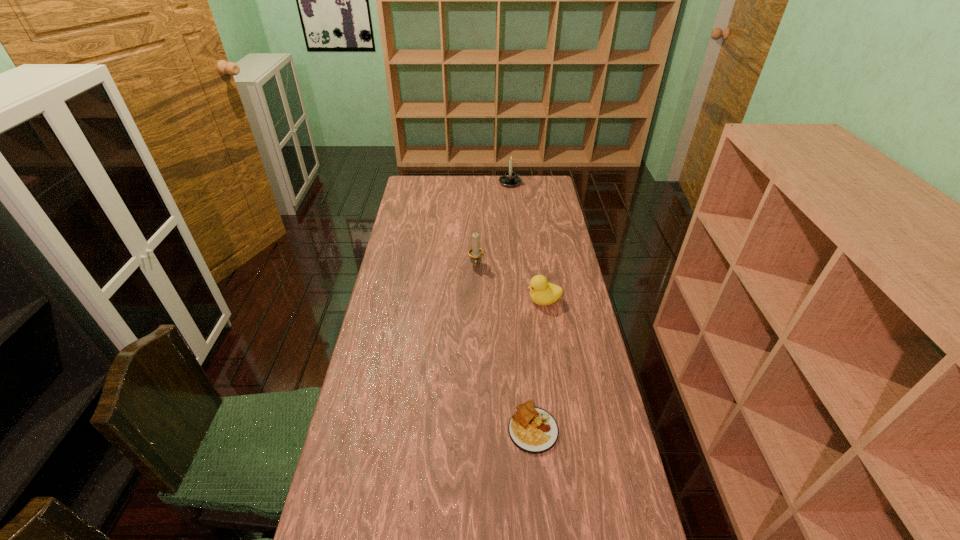
Find the location of a particular element. Image resolution: width=960 pixels, height=540 pixels. the left candle holder is located at coordinates (475, 253).

At what (x,y) coordinates should I click in order to perform the action: click on the third nearest object. Please return your answer as a coordinate pair (x, y). This screenshot has width=960, height=540. Looking at the image, I should click on (475, 253).

Where is `the farther candle holder`? the farther candle holder is located at coordinates (510, 179).

Where is `the right candle holder`? The width and height of the screenshot is (960, 540). the right candle holder is located at coordinates (510, 179).

You are a GUI agent. You are given a task and a screenshot of the screen. Output one action in this format:
    pyautogui.click(x=<x>, y=<y>)
    Task: Click on the duck
    The height and width of the screenshot is (540, 960).
    Given the screenshot: What is the action you would take?
    click(542, 293)

Find the location of a particular element. The width and height of the screenshot is (960, 540). the third tallest object is located at coordinates (x=542, y=293).

Locate an element on the screen. Image resolution: width=960 pixels, height=540 pixels. the nearest object is located at coordinates (533, 430).

This screenshot has height=540, width=960. Find the location of `omelet`. omelet is located at coordinates (533, 430).

Where is `vacant space located 0.240m on the handle side of the left candle holder`? vacant space located 0.240m on the handle side of the left candle holder is located at coordinates (475, 317).

Where is `free space located with a handle on the side of the farthest object`? Image resolution: width=960 pixels, height=540 pixels. free space located with a handle on the side of the farthest object is located at coordinates (550, 183).